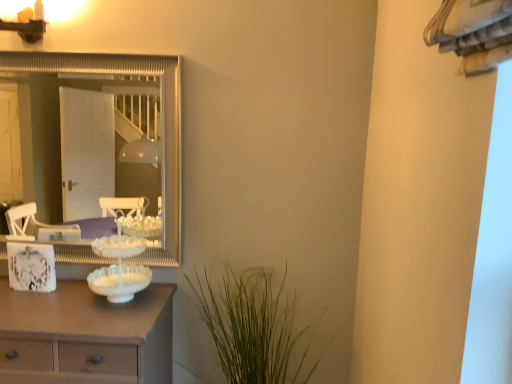
The image size is (512, 384). I want to click on empty space that is ontop of silver/metallic mirror at upper left (from a real-world perspective), so click(87, 54).